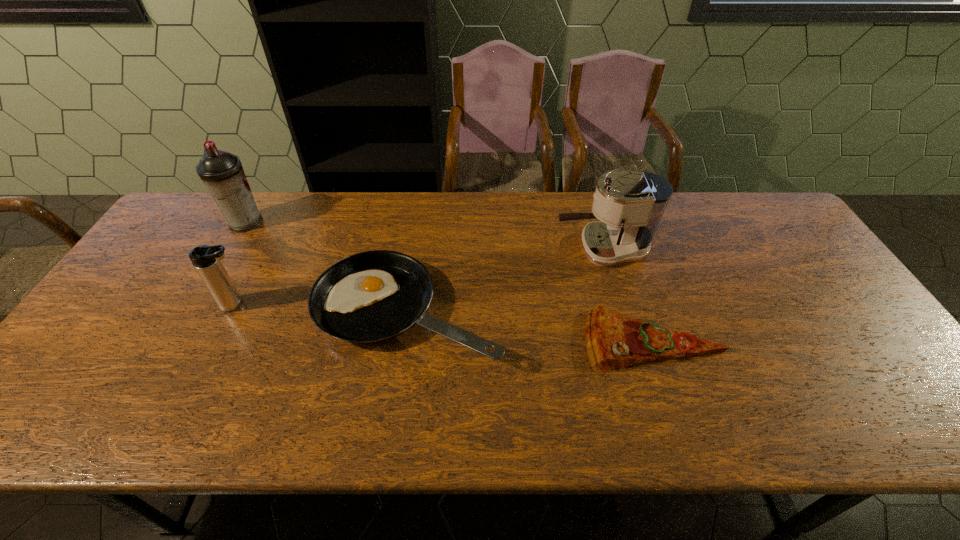
I want to click on unoccupied area between the shortest object and the leftmost object, so click(x=449, y=281).

Where is `free space between the leftmost object and the fourth object from right to left`? Image resolution: width=960 pixels, height=540 pixels. free space between the leftmost object and the fourth object from right to left is located at coordinates [241, 264].

Where is `vacant space in between the leftmost object and the shortest object`? vacant space in between the leftmost object and the shortest object is located at coordinates (449, 281).

What are the coordinates of `vacant space that's between the coffee maker and the pizza` in the screenshot? It's located at (628, 295).

Where is `free space that is in between the leftmost object and the thermos bottle`? The height and width of the screenshot is (540, 960). free space that is in between the leftmost object and the thermos bottle is located at coordinates (241, 264).

Where is `free space between the leftmost object and the coffee maker`? This screenshot has width=960, height=540. free space between the leftmost object and the coffee maker is located at coordinates (423, 236).

Locate an element on the screen. This screenshot has height=540, width=960. object identified as the third closest to the third tallest object is located at coordinates (630, 205).

Select which object is the second closest to the pizza. Please provide its 2D coordinates. Your answer should be formatted as a tuple, i.e. [(x, y)], where the tuple contains the x and y coordinates of a point satisfying the conditions above.

[(372, 296)]

Where is `blank area in the image that satisfies the following two spatial constraints: 1. on the handle side of the shortest object; 2. on the left side of the third tallest object`? The height and width of the screenshot is (540, 960). blank area in the image that satisfies the following two spatial constraints: 1. on the handle side of the shortest object; 2. on the left side of the third tallest object is located at coordinates point(219,340).

Locate an element on the screen. The height and width of the screenshot is (540, 960). free space in the image that satisfies the following two spatial constraints: 1. on the handle side of the pizza; 2. on the right side of the third tallest object is located at coordinates (219, 340).